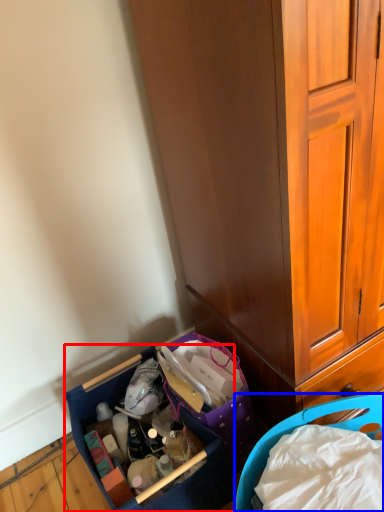
Question: Among these objects, which one is farthest to the camera, picnic basket (highlighted by a red box) or picnic basket (highlighted by a blue box)?

Choices:
 (A) picnic basket
 (B) picnic basket

Answer: (A)